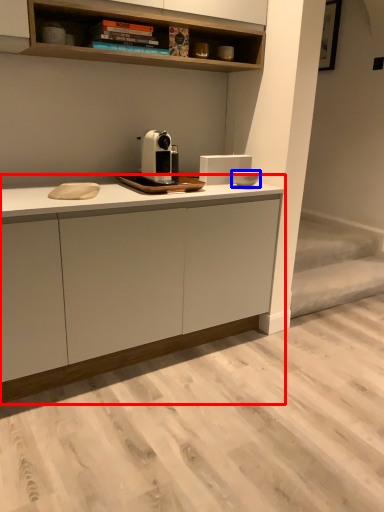
Question: Which point is closer to the camera, cabinetry (highlighted by a red box) or appliance (highlighted by a blue box)?

Choices:
 (A) cabinetry
 (B) appliance

Answer: (A)